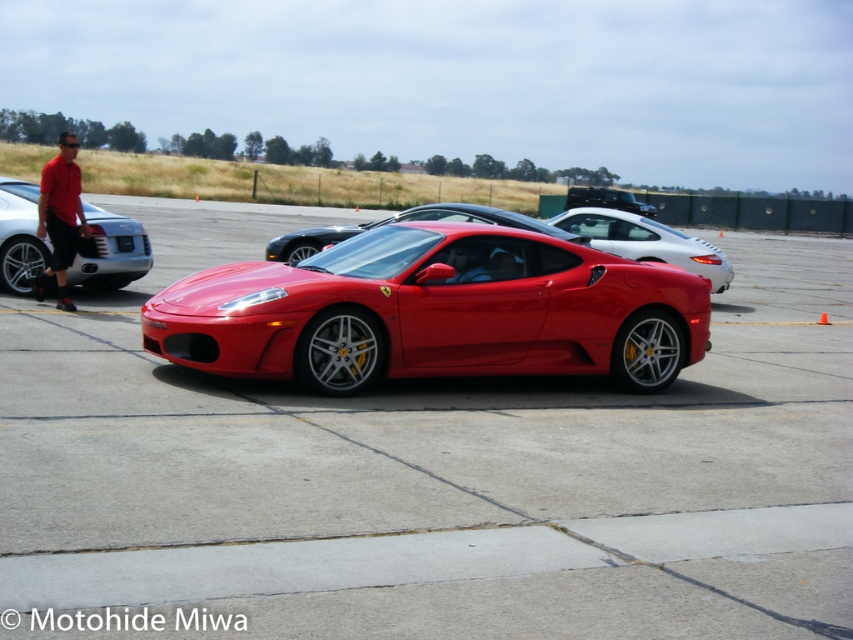
Question: Is shiny red ferrari at center bigger than shiny silver car at left?

Choices:
 (A) no
 (B) yes

Answer: (B)

Question: Which point is farther to the camera?

Choices:
 (A) shiny red sports car at center
 (B) shiny silver car at left
 (C) matte red shirt at left

Answer: (B)

Question: Among these points, which one is farthest from the camera?

Choices:
 (A) (131, 545)
 (B) (654, 364)
 (C) (10, 202)

Answer: (C)

Question: Is shiny silver car at left to the left of matte red shirt at left from the viewer's perspective?

Choices:
 (A) no
 (B) yes

Answer: (A)

Question: Can you confirm if shiny red ferrari at center is positioned above shiny red sports car at center?

Choices:
 (A) no
 (B) yes

Answer: (A)

Question: Which point is farther to the camera?

Choices:
 (A) (74, 221)
 (B) (305, 212)
 (C) (619, 205)

Answer: (B)